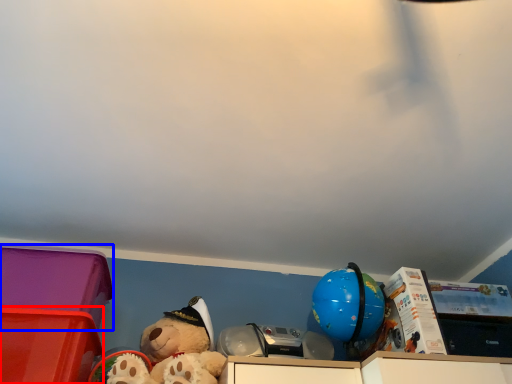
Question: Among these objects, which one is nearest to the camera, storage box (highlighted by a red box) or storage box (highlighted by a blue box)?

Choices:
 (A) storage box
 (B) storage box

Answer: (A)